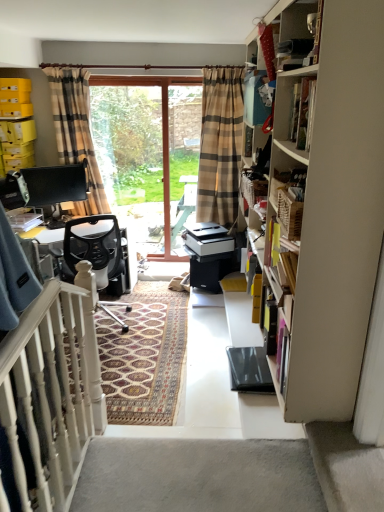
Question: Is clear glass screen door at center spatially inside wooden cabinet at upper right, or outside of it?

Choices:
 (A) inside
 (B) outside

Answer: (B)

Question: Looking at their shapes, would you say clear glass screen door at center is wider or thinner than wooden cabinet at upper right?

Choices:
 (A) wide
 (B) thin

Answer: (B)

Question: Considering the real-world distances, which object is farthest from the white carpet at lower right?

Choices:
 (A) black mesh office chair at center
 (B) wooden cabinet at upper right
 (C) plaid fabric curtain at left
 (D) clear glass screen door at center
 (E) white wooden balustrade at lower left

Answer: (D)

Question: Which of these objects is positioned closest to the white carpet at lower right?

Choices:
 (A) white wooden balustrade at lower left
 (B) clear glass screen door at center
 (C) plaid fabric curtain at left
 (D) black mesh office chair at center
 (E) wooden cabinet at upper right

Answer: (A)